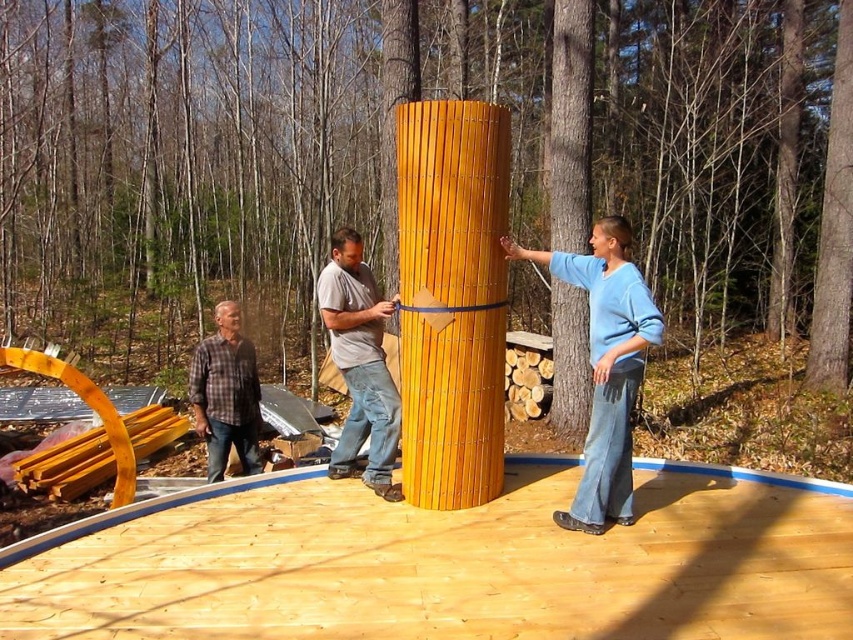
Is point (461, 481) positioned in front of point (384, 365)?

That is True.

Who is shorter, smooth bamboo pillar at center or matte gray shirt at center?

matte gray shirt at center

Who is more distant from viewer, (x=492, y=314) or (x=344, y=362)?

Positioned behind is point (x=344, y=362).

Find the location of `smooth bamboo pillar at center`. smooth bamboo pillar at center is located at coordinates (451, 298).

Is smooth bamboo pillar at center closer to the viewer compared to plaid fabric shirt at lower left?

Yes.

Between point (403, 474) and point (231, 372), which one is positioned behind?

The point (231, 372) is behind.

Who is more forward, (436, 408) or (236, 323)?

Point (436, 408) is in front.

Identify the location of smooth bamboo pillar at center. point(451,298).

Based on the photo, does smooth bamboo pillar at center have a larger size compared to blue cotton sweater at center?

Actually, smooth bamboo pillar at center might be smaller than blue cotton sweater at center.

Consider the image. Is smooth bamboo pillar at center above blue cotton sweater at center?

Indeed, smooth bamboo pillar at center is positioned over blue cotton sweater at center.

Where is `smooth bamboo pillar at center`? The image size is (853, 640). smooth bamboo pillar at center is located at coordinates (451, 298).